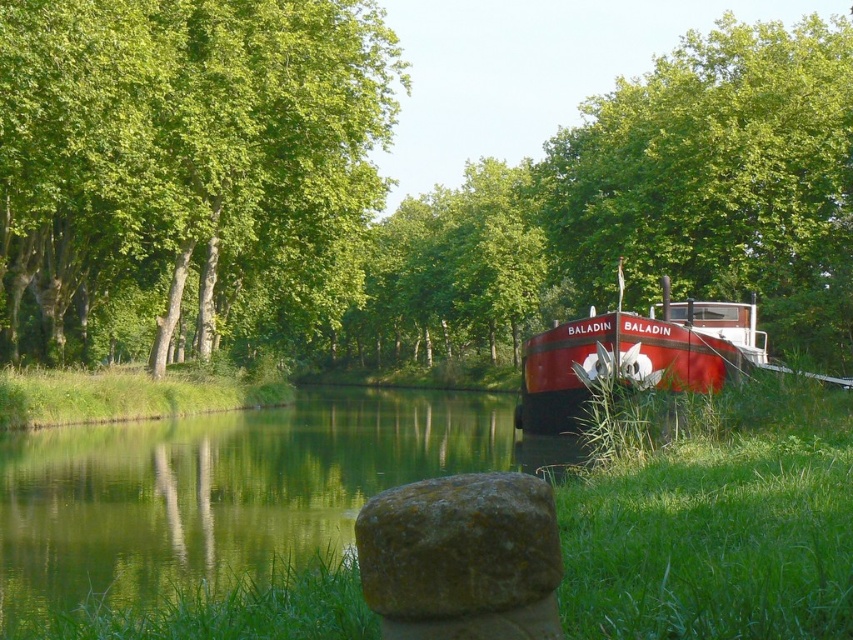
Who is shorter, green leafy tree at right or green grass at right?

green grass at right

Is green leafy tree at right in front of green grass at right?

That is False.

Is point (700, 48) closer to camera compared to point (653, 573)?

No, (700, 48) is behind (653, 573).

Locate an element on the screen. green leafy tree at right is located at coordinates (389, 189).

Can you confirm if green leafy tree at right is wider than green mossy rock at lower center?

Correct, the width of green leafy tree at right exceeds that of green mossy rock at lower center.

Who is taller, green leafy tree at right or green mossy rock at lower center?

green leafy tree at right is taller.

You are a GUI agent. You are given a task and a screenshot of the screen. Output one action in this format:
    pyautogui.click(x=<x>, y=<y>)
    Task: Click on the green leafy tree at right
    The width and height of the screenshot is (853, 640).
    Given the screenshot: What is the action you would take?
    pyautogui.click(x=389, y=189)

Who is positioned more to the left, green mossy rock at lower center or shiny red boat at right?

green mossy rock at lower center is more to the left.

Does green mossy rock at lower center lie in front of shiny red boat at right?

Yes, green mossy rock at lower center is closer to the viewer.

Is point (374, 560) closer to viewer compared to point (746, 352)?

Yes, point (374, 560) is in front of point (746, 352).

Where is `green mossy rock at lower center`? The image size is (853, 640). green mossy rock at lower center is located at coordinates 462,557.